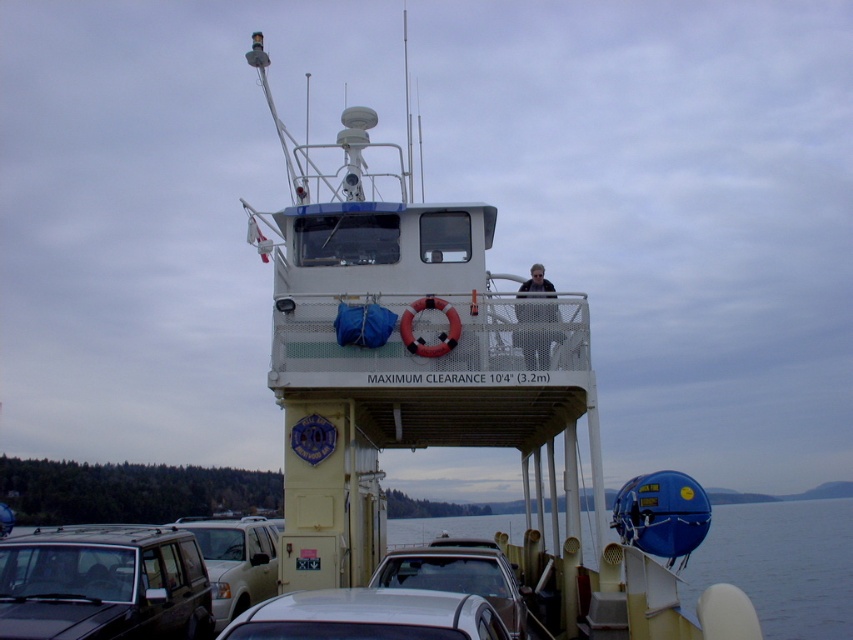
You are a ferry attendant checking the parking arrangement. You see the matte black suv at lower left and the silver metallic car at lower center. Which vehicle is parked more to the left side?

The matte black suv at lower left is parked more to the left side than the silver metallic car at lower center.

You are standing on the ferry deck and want to board the white matte boat at center. The boat has a safety rule stating that passengers must be at least 30 feet away from the control cabin. Are you within the safe distance?

The white matte boat at center is 26.74 feet away from the viewer, which is less than the required 30 feet safety distance. Therefore, you are not within the safe distance.